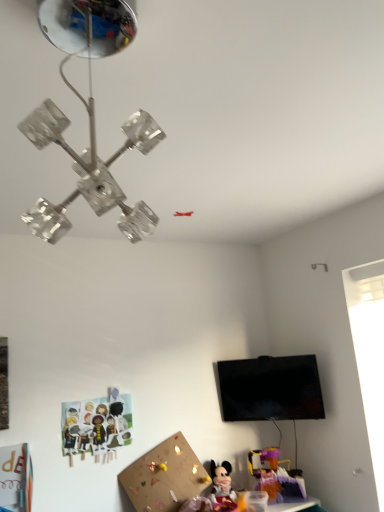
Question: From a real-world perspective, is paper cutout characters at lower left, which ranks as the third toy in right-to-left order, on plastic purple toy at lower right, the third toy when ordered from left to right?

Choices:
 (A) no
 (B) yes

Answer: (B)

Question: Considering the relative sizes of paper cutout characters at lower left, which ranks as the third toy in right-to-left order, and plastic purple toy at lower right, the 1th toy positioned from the right, in the image provided, is paper cutout characters at lower left, which ranks as the third toy in right-to-left order, shorter than plastic purple toy at lower right, the 1th toy positioned from the right,?

Choices:
 (A) no
 (B) yes

Answer: (A)

Question: Is paper cutout characters at lower left, which ranks as the third toy in right-to-left order, closer to camera compared to plastic purple toy at lower right, the 1th toy positioned from the right?

Choices:
 (A) no
 (B) yes

Answer: (B)

Question: Is paper cutout characters at lower left, which is counted as the 1th toy, starting from the left, beside plastic purple toy at lower right, the 1th toy positioned from the right?

Choices:
 (A) yes
 (B) no

Answer: (B)

Question: From a real-world perspective, is paper cutout characters at lower left, which ranks as the third toy in right-to-left order, physically below plastic purple toy at lower right, the third toy when ordered from left to right?

Choices:
 (A) yes
 (B) no

Answer: (B)

Question: Is plastic purple toy at lower right, the 1th toy positioned from the right, spatially inside translucent plastic table at lower right, or outside of it?

Choices:
 (A) outside
 (B) inside

Answer: (A)

Question: From the image's perspective, relative to translucent plastic table at lower right, is plastic purple toy at lower right, the 1th toy positioned from the right, above or below?

Choices:
 (A) above
 (B) below

Answer: (A)

Question: Looking at their shapes, would you say plastic purple toy at lower right, the 1th toy positioned from the right, is wider or thinner than translucent plastic table at lower right?

Choices:
 (A) wide
 (B) thin

Answer: (B)

Question: Considering the relative positions of plastic purple toy at lower right, the third toy when ordered from left to right, and translucent plastic table at lower right in the image provided, is plastic purple toy at lower right, the third toy when ordered from left to right, to the left or to the right of translucent plastic table at lower right?

Choices:
 (A) right
 (B) left

Answer: (B)

Question: Looking at their shapes, would you say clear glass chandelier at upper center is wider or thinner than paper cutout characters at lower left, which ranks as the third toy in right-to-left order?

Choices:
 (A) thin
 (B) wide

Answer: (B)

Question: From the image's perspective, is clear glass chandelier at upper center located above or below paper cutout characters at lower left, which is counted as the 1th toy, starting from the left?

Choices:
 (A) above
 (B) below

Answer: (A)

Question: In terms of size, does clear glass chandelier at upper center appear bigger or smaller than paper cutout characters at lower left, which ranks as the third toy in right-to-left order?

Choices:
 (A) small
 (B) big

Answer: (B)

Question: Is clear glass chandelier at upper center taller or shorter than paper cutout characters at lower left, which ranks as the third toy in right-to-left order?

Choices:
 (A) short
 (B) tall

Answer: (B)

Question: Choose the correct answer: Is clear glass chandelier at upper center inside plastic purple toy at lower right, the 1th toy positioned from the right, or outside it?

Choices:
 (A) inside
 (B) outside

Answer: (B)

Question: Is clear glass chandelier at upper center bigger or smaller than plastic purple toy at lower right, the third toy when ordered from left to right?

Choices:
 (A) big
 (B) small

Answer: (A)